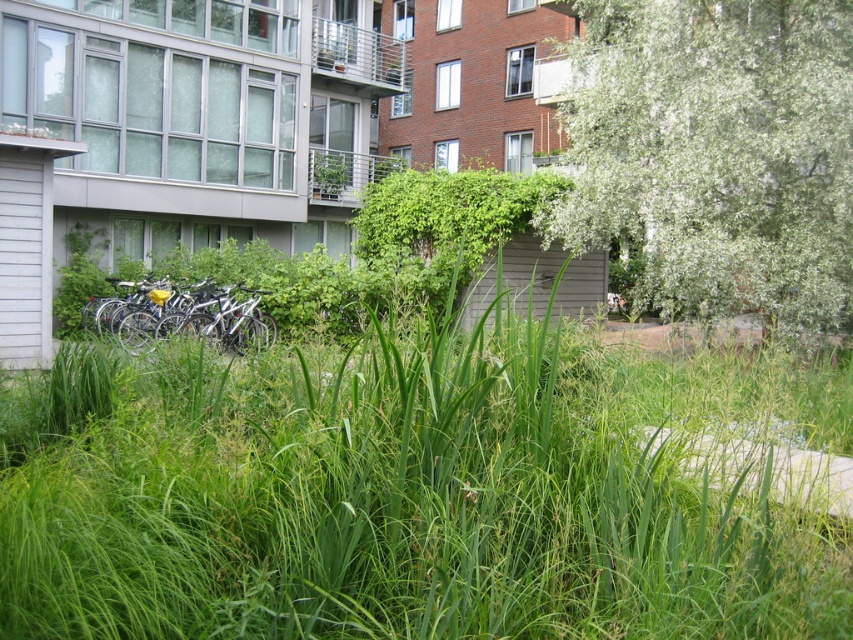
Looking at this image, you are a visitor in this urban green space and want to take a photo of both the white fluffy tree at upper right and the silver metallic bicycle at left. Can you position yourself in a way that both are visible in the same frame?

Yes, since the white fluffy tree at upper right is to the right of the silver metallic bicycle at left, you can position yourself between them to capture both in the same frame.

You are a pedestrian standing at the entrance of the paved pathway and want to walk towards the silver metallic bicycle at left. However, you notice the white fluffy tree at upper right blocking your path. Can you walk around the tree to reach the bicycle?

The white fluffy tree at upper right is in front of the silver metallic bicycle at left, so you can walk around the tree to reach the bicycle since it is blocking the direct path but not the entire route.